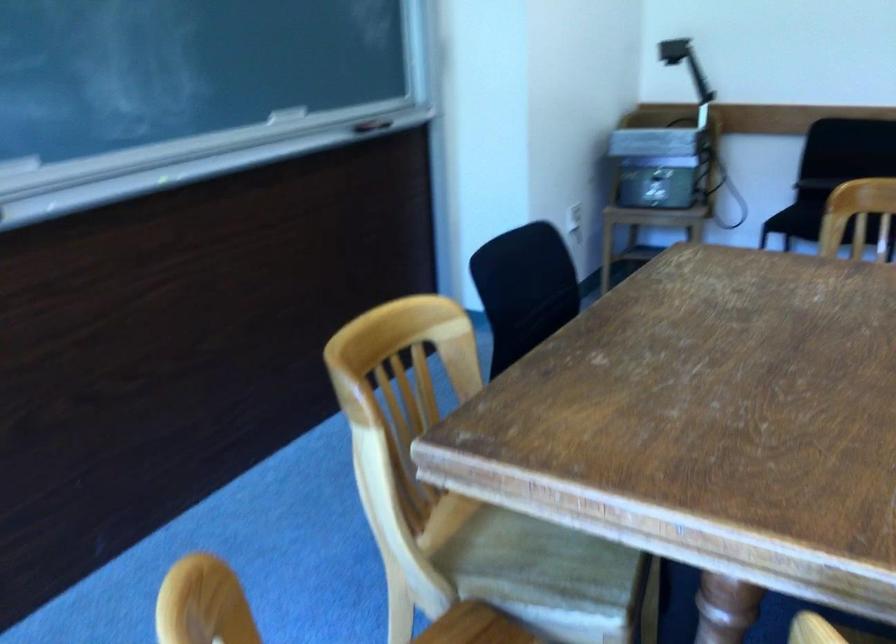
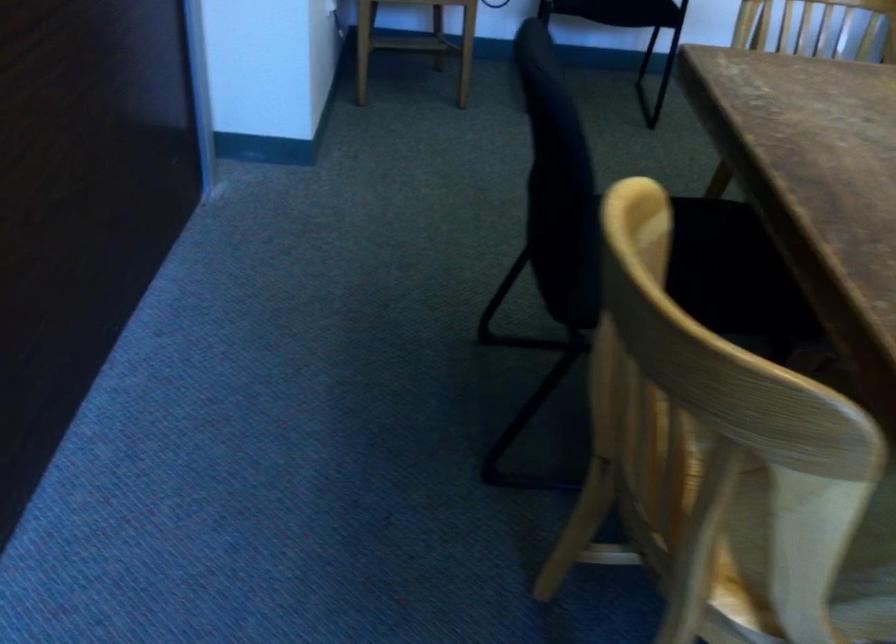
In the second image, find the point that corresponds to point (549, 560) in the first image.

(872, 538)